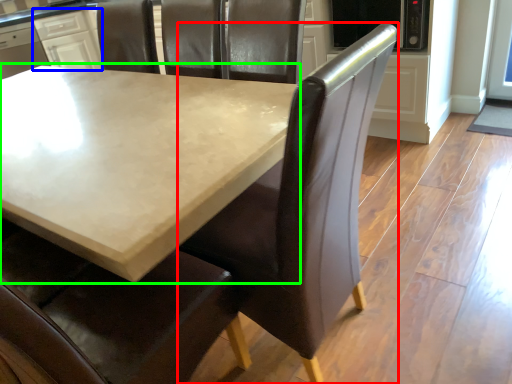
Question: Considering the real-world distances, which object is closest to chair (highlighted by a red box)? cabinetry (highlighted by a blue box) or table (highlighted by a green box).

Choices:
 (A) cabinetry
 (B) table

Answer: (B)